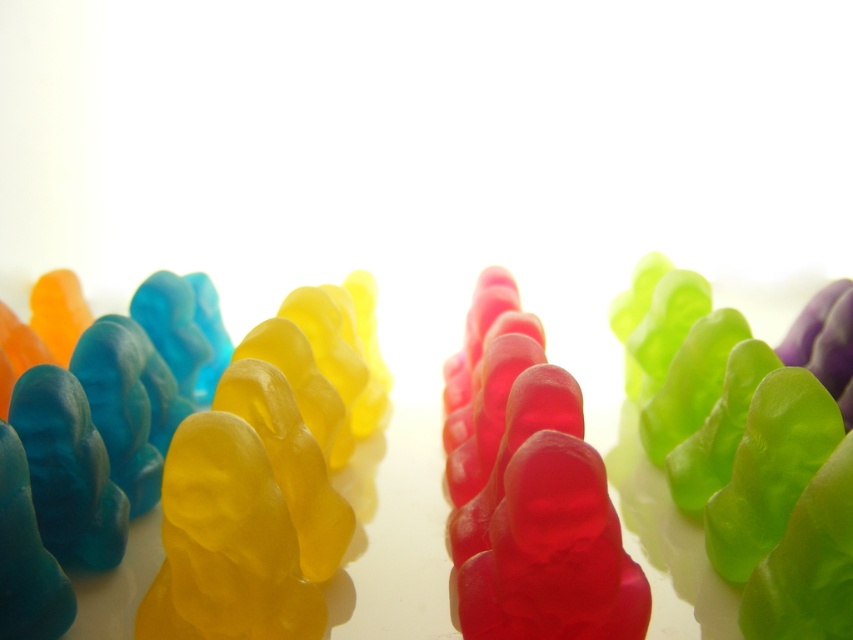
Question: From the image, what is the correct spatial relationship of yellow translucent gummy bear at left in relation to translucent jelly bear at center?

Choices:
 (A) left
 (B) right

Answer: (A)

Question: Does yellow translucent gummy bear at left appear on the left side of translucent jelly bear at center?

Choices:
 (A) yes
 (B) no

Answer: (A)

Question: Is translucent gelatin bear at center to the right of translucent jelly bear at center from the viewer's perspective?

Choices:
 (A) yes
 (B) no

Answer: (B)

Question: Which object is positioned farthest from the translucent jelly bear at center?

Choices:
 (A) yellow translucent gummy bear at left
 (B) translucent gelatin bear at center

Answer: (A)

Question: Among these points, which one is farthest from the camera?

Choices:
 (A) (254, 388)
 (B) (322, 609)

Answer: (A)

Question: Which of the following is the closest to the observer?

Choices:
 (A) (547, 579)
 (B) (312, 502)
 (C) (325, 433)

Answer: (A)